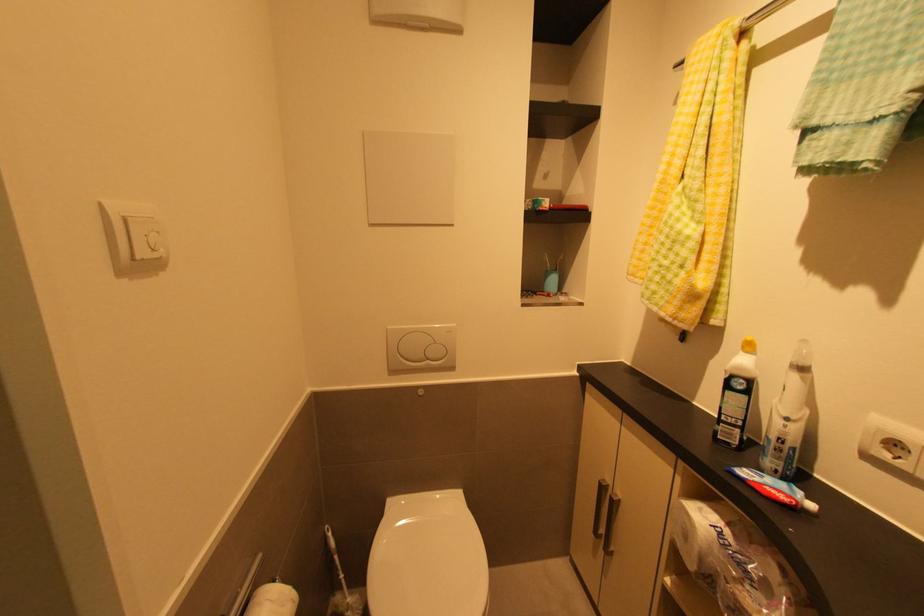
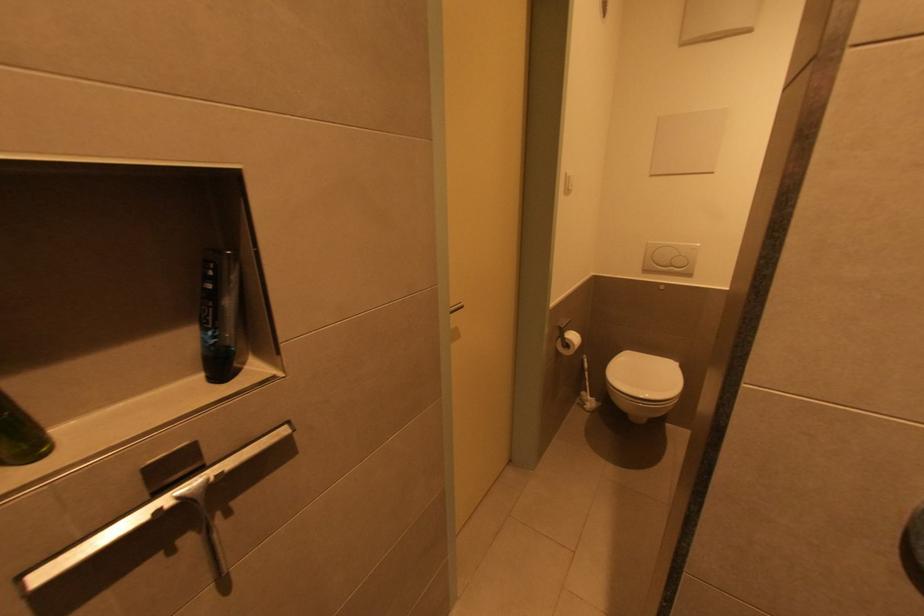
Question: Based on the continuous images, in which direction is the camera rotating? Reply with the corresponding letter.

Choices:
 (A) Left
 (B) Right
 (C) Up
 (D) Down

Answer: (A)